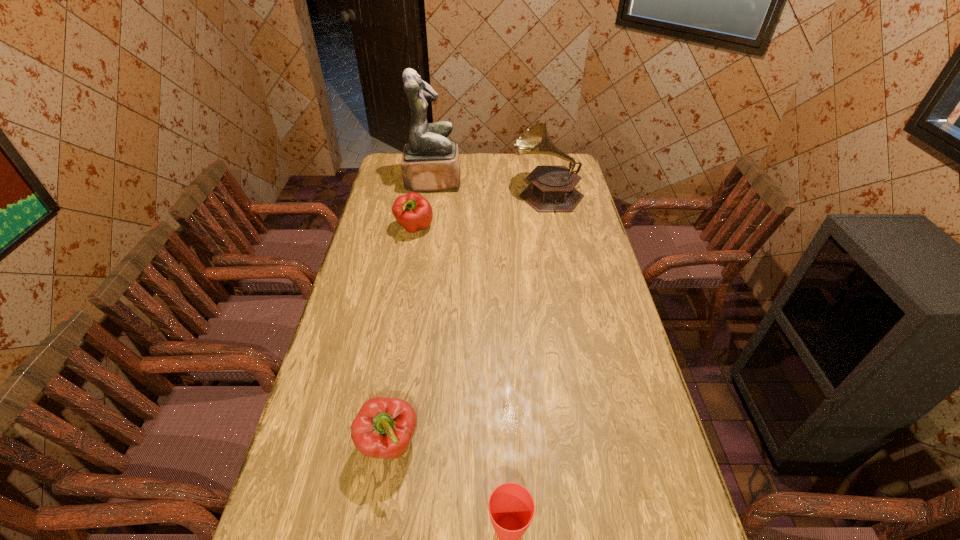
Identify the location of vacant space that's between the fourth shortest object and the tallest object. The image size is (960, 540). (491, 187).

This screenshot has height=540, width=960. I want to click on empty space between the rightmost object and the third farthest object, so click(x=481, y=211).

The width and height of the screenshot is (960, 540). What are the coordinates of `unoccupied position between the phonograph record and the third nearest object` in the screenshot? It's located at (481, 211).

Where is `free space between the second nearest object and the tallest object`? Image resolution: width=960 pixels, height=540 pixels. free space between the second nearest object and the tallest object is located at coordinates (412, 312).

Locate an element on the screen. The width and height of the screenshot is (960, 540). free space between the sculpture and the second tallest object is located at coordinates (491, 187).

Identify the location of the third closest object to the sculpture. The image size is (960, 540). (384, 427).

The image size is (960, 540). Find the location of `the third closest object to the sculpture`. the third closest object to the sculpture is located at coordinates (384, 427).

This screenshot has width=960, height=540. In order to click on vacant region that satisfies the following two spatial constraints: 1. on the front side of the nearer bell pepper; 2. on the right side of the farther bell pepper in this screenshot , I will do point(375,444).